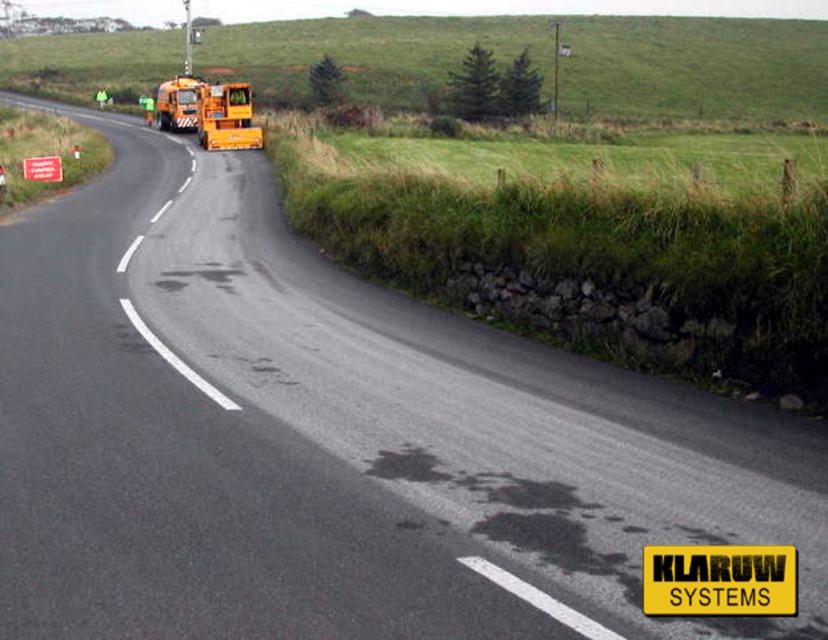
In the scene shown: You are driving a delivery truck that is 10 meters long. You need to pass through the road where the yellow metallic school bus at upper left is located. Can your truck fit through the road if the road is 50 meters long?

The distance between you and the yellow metallic school bus at upper left is 49.93 meters. Since your truck is 10 meters long and the road is 50 meters long, there is only 0.07 meters of space left, which is insufficient. Your truck cannot safely pass through the road.

In the scene shown: You are a delivery driver who needs to pass under a bridge that has a height restriction of 4 meters. You are currently observing the scene and see the yellow metallic school bus at upper left and the orange metallic truck at upper left. Which vehicle do you think is more likely to exceed the height limit if both are similar in length?

The yellow metallic school bus at upper left has a greater height compared to the orange metallic truck at upper left, so it is more likely to exceed the height limit of 4 meters.